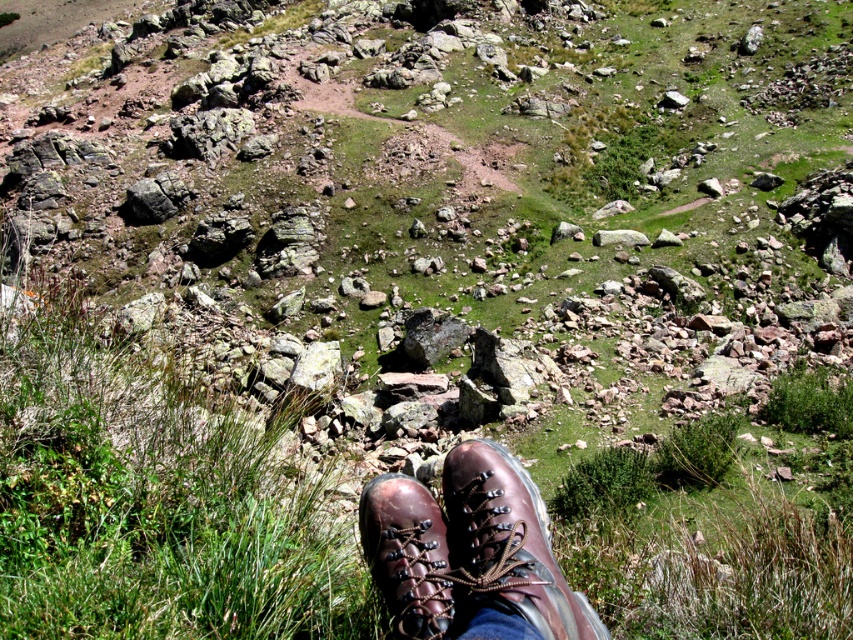
Between point (456, 500) and point (421, 589), which one is positioned behind?

Point (456, 500)

Is shiny brown leather boot at lower center shorter than brown leather boot at lower center?

No, shiny brown leather boot at lower center is not shorter than brown leather boot at lower center.

Is point (509, 557) more distant than point (361, 500)?

That is False.

This screenshot has height=640, width=853. What are the coordinates of `shiny brown leather boot at lower center` in the screenshot? It's located at (508, 541).